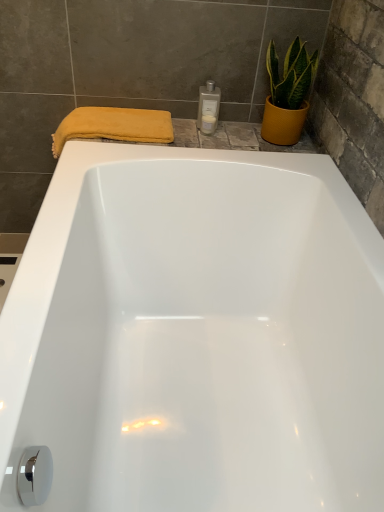
Question: Which is correct: yellow textured pot at upper right is inside white glossy bottle at upper center, the second toiletry positioned from the top, or outside of it?

Choices:
 (A) outside
 (B) inside

Answer: (A)

Question: From the image's perspective, is yellow textured pot at upper right above or below white glossy bottle at upper center, the second toiletry positioned from the top?

Choices:
 (A) below
 (B) above

Answer: (B)

Question: Considering the real-world distances, which object is farthest from the white glossy bottle at upper center, the second toiletry positioned from the top?

Choices:
 (A) yellow textured pot at upper right
 (B) white glossy bottle at upper right, which ranks as the 1th toiletry in top-to-bottom order
 (C) yellow soft towel at upper left

Answer: (C)

Question: Estimate the real-world distances between objects in this image. Which object is farther from the white glossy bottle at upper center, the second toiletry positioned from the top?

Choices:
 (A) yellow soft towel at upper left
 (B) yellow textured pot at upper right
 (C) white glossy bottle at upper right, which appears as the second toiletry when ordered from the bottom

Answer: (A)